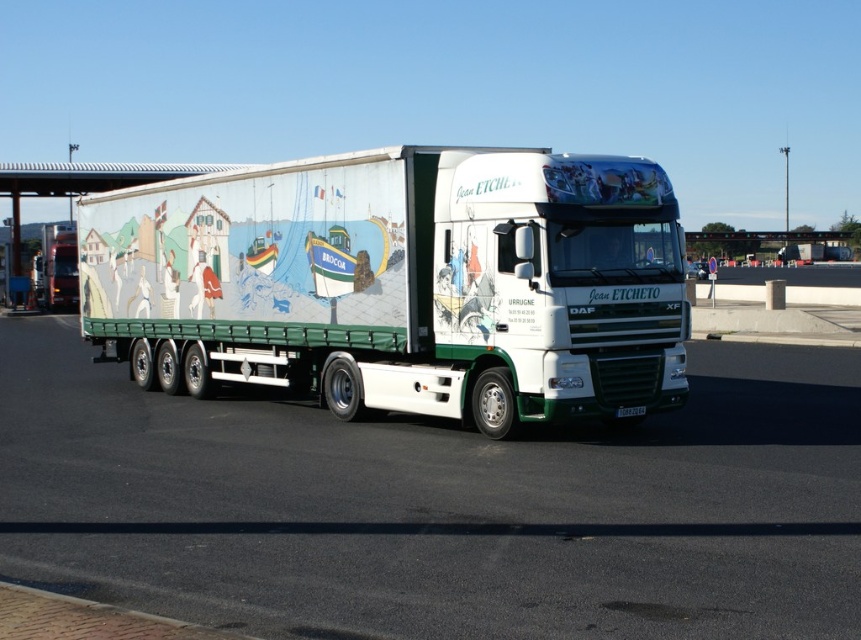
You are a driver who needs to check the license plate of the truck. Since both the white asphalt highway at center and the white plastic license plate at center are in your view, which one is larger in size?

The white asphalt highway at center is bigger than the white plastic license plate at center, so the highway is larger in size.

You are driving a car and want to pass the white glossy truck at center on the white asphalt highway at center. According to the scene description, which side should you move to in order to safely pass the truck?

Since the white asphalt highway at center is to the right of the white glossy truck at center, you should move to the right side of the truck to safely pass it.

You are driving a car and see the white asphalt highway at center and the gray concrete highway at center. Which one is lower in position?

The white asphalt highway at center is below the gray concrete highway at center, so it is lower in position.